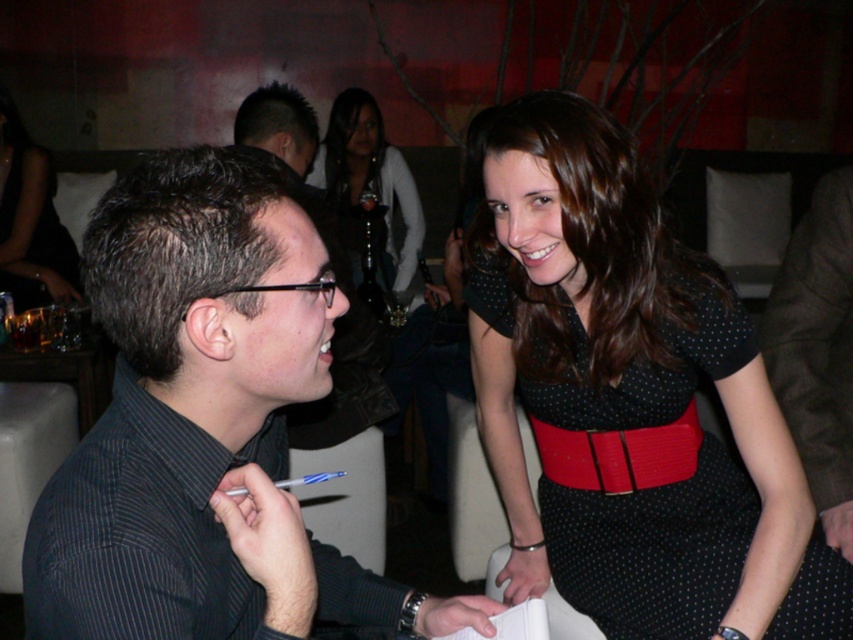
Can you confirm if black dotted fabric dress at upper right is taller than black satin dress at center?

No, black dotted fabric dress at upper right is not taller than black satin dress at center.

Is point (576, 492) positioned before point (39, 163)?

That is True.

What do you see at coordinates (653, 548) in the screenshot? Image resolution: width=853 pixels, height=640 pixels. I see `black dotted fabric dress at upper right` at bounding box center [653, 548].

Locate an element on the screen. black dotted fabric dress at upper right is located at coordinates (653, 548).

Is black dotted fabric dress at upper right further to camera compared to matte black dress at center?

No, black dotted fabric dress at upper right is closer to the viewer.

Who is more distant from viewer, [738,570] or [347,145]?

The point [347,145] is behind.

Does point (699, 461) come farther from viewer compared to point (381, 262)?

No, it is in front of (381, 262).

You are a GUI agent. You are given a task and a screenshot of the screen. Output one action in this format:
    pyautogui.click(x=<x>, y=<y>)
    Task: Click on the black dotted fabric dress at upper right
    The height and width of the screenshot is (640, 853).
    Given the screenshot: What is the action you would take?
    (x=653, y=548)

Measure the distance between dark gray striped shirt at left and black satin dress at center.

dark gray striped shirt at left is 2.56 meters from black satin dress at center.

Does dark gray striped shirt at left have a greater width compared to black satin dress at center?

Yes.

Find the location of a particular element. This screenshot has width=853, height=640. dark gray striped shirt at left is located at coordinates (196, 422).

Identify the location of dark gray striped shirt at left. This screenshot has width=853, height=640. (196, 422).